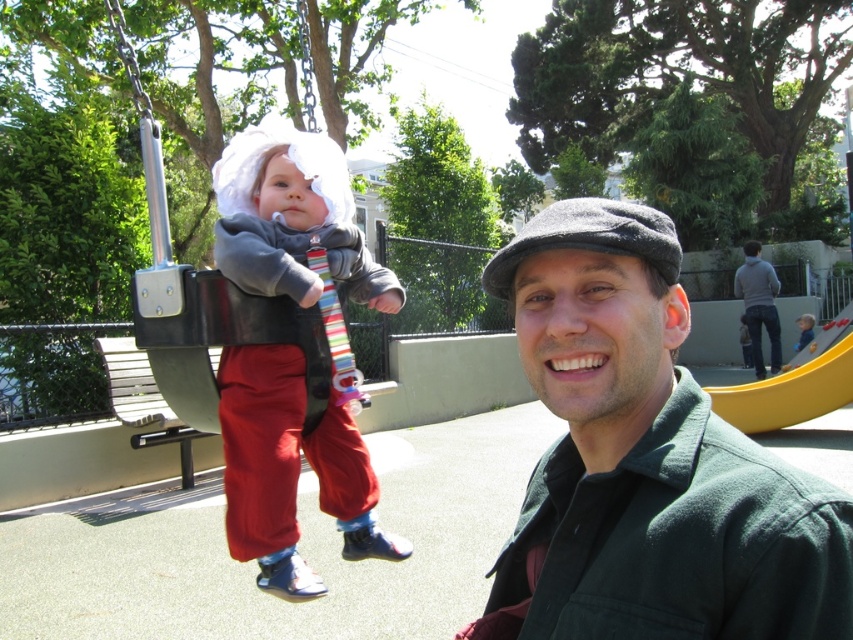
Who is more forward, (303,368) or (801,314)?

Positioned in front is point (303,368).

Is matte gray sweater at center closer to the viewer compared to light blue knit sweater at center?

Yes.

The width and height of the screenshot is (853, 640). What do you see at coordinates (289, 470) in the screenshot?
I see `matte gray sweater at center` at bounding box center [289, 470].

The height and width of the screenshot is (640, 853). Find the location of `matte gray sweater at center`. matte gray sweater at center is located at coordinates (289, 470).

Looking at this image, is matte gray sweater at center positioned behind black plastic swing at upper left?

No.

Image resolution: width=853 pixels, height=640 pixels. I want to click on matte gray sweater at center, so click(x=289, y=470).

Identify the location of matte gray sweater at center. (289, 470).

Between green woolen jacket at center and dark gray woolen cap at upper center, which one appears on the right side from the viewer's perspective?

Positioned to the right is dark gray woolen cap at upper center.

Can you confirm if green woolen jacket at center is positioned above dark gray woolen cap at upper center?

Incorrect, green woolen jacket at center is not positioned above dark gray woolen cap at upper center.

What do you see at coordinates (646, 461) in the screenshot?
I see `green woolen jacket at center` at bounding box center [646, 461].

The width and height of the screenshot is (853, 640). Find the location of `green woolen jacket at center`. green woolen jacket at center is located at coordinates (646, 461).